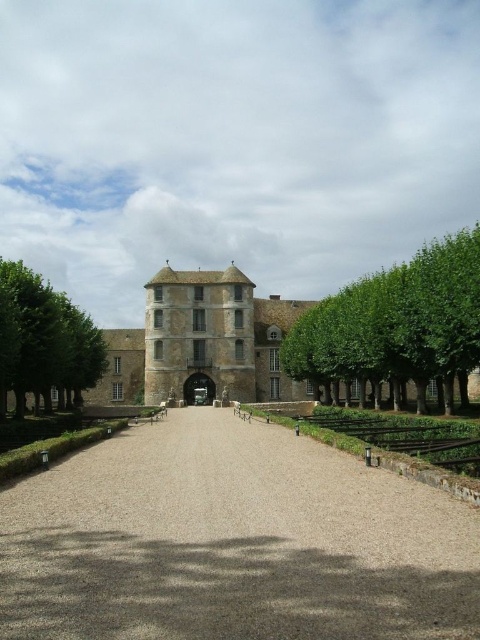
You are standing at the entrance of the chateau and want to find the green leafy tree at center. In which direction should you look relative to the entrance?

The green leafy tree at center is located directly in front of the entrance, so you should look straight ahead.

In the scene shown: You are standing at the entrance of the chateau and want to walk to the gray gravel driveway at center. Which direction should you walk relative to the green leafy tree at center?

The gray gravel driveway at center is below the green leafy tree at center, so you should walk downward towards the gray gravel driveway at center relative to the green leafy tree at center.

You are driving a delivery van that is 2.5 meters wide. You need to navigate through the gray gravel driveway at center and pass by the green leafy tree at left. Can your van fit through the driveway without hitting the tree?

The gray gravel driveway at center might be wider than green leafy tree at left, but since the exact width isn not specified, it is uncertain if the van can safely pass without hitting the tree.